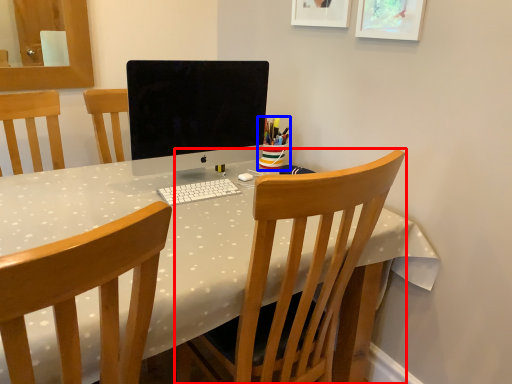
Question: Among these objects, which one is nearest to the camera, chair (highlighted by a red box) or stationery (highlighted by a blue box)?

Choices:
 (A) chair
 (B) stationery

Answer: (A)